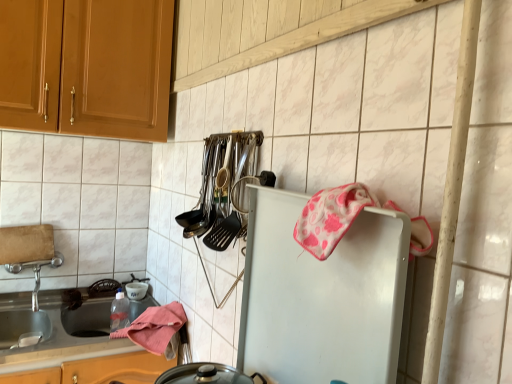
Question: From the image's perspective, is polished stainless steel utensils at center above or below white matte refrigerator at center-right?

Choices:
 (A) above
 (B) below

Answer: (A)

Question: In terms of height, does polished stainless steel utensils at center look taller or shorter compared to white matte refrigerator at center-right?

Choices:
 (A) tall
 (B) short

Answer: (B)

Question: Which object is positioned closest to the pink fabric towel at lower left, which is the second material in front-to-back order?

Choices:
 (A) white glossy countertop at lower left
 (B) white matte refrigerator at center-right
 (C) pink fabric towel at upper right, acting as the 1th material starting from the right
 (D) polished stainless steel utensils at center

Answer: (A)

Question: Estimate the real-world distances between objects in this image. Which object is closer to the pink fabric towel at lower left, placed as the second material when sorted from top to bottom?

Choices:
 (A) pink fabric towel at upper right, which is the first material in top-to-bottom order
 (B) polished stainless steel utensils at center
 (C) white glossy countertop at lower left
 (D) white matte refrigerator at center-right

Answer: (C)